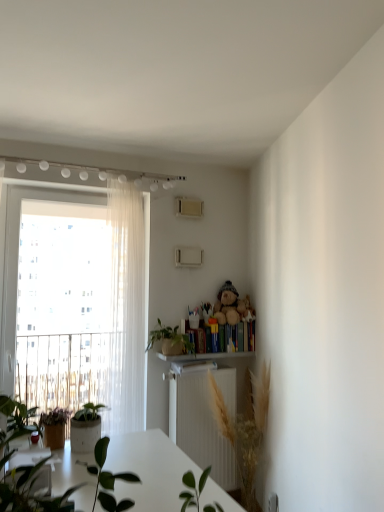
Question: Is green leafy plant at center, which is counted as the first houseplant, starting from the bottom, at the left side of fuzzy brown teddy bear at upper center?

Choices:
 (A) no
 (B) yes

Answer: (B)

Question: Considering the relative sizes of green leafy plant at center, which is counted as the first houseplant, starting from the bottom, and fuzzy brown teddy bear at upper center in the image provided, is green leafy plant at center, which is counted as the first houseplant, starting from the bottom, bigger than fuzzy brown teddy bear at upper center?

Choices:
 (A) no
 (B) yes

Answer: (B)

Question: Does green leafy plant at center, the 2th houseplant viewed from the top, have a lesser height compared to fuzzy brown teddy bear at upper center?

Choices:
 (A) no
 (B) yes

Answer: (A)

Question: Is green leafy plant at center, which is counted as the first houseplant, starting from the bottom, facing away from fuzzy brown teddy bear at upper center?

Choices:
 (A) no
 (B) yes

Answer: (A)

Question: Can you confirm if green leafy plant at center, which is counted as the first houseplant, starting from the bottom, is positioned to the right of fuzzy brown teddy bear at upper center?

Choices:
 (A) yes
 (B) no

Answer: (B)

Question: Considering the relative positions of sheer white curtain at left and green leafy plant at center, the 2th houseplant viewed from the top, in the image provided, is sheer white curtain at left to the left or to the right of green leafy plant at center, the 2th houseplant viewed from the top,?

Choices:
 (A) right
 (B) left

Answer: (B)

Question: In terms of size, does sheer white curtain at left appear bigger or smaller than green leafy plant at center, the 2th houseplant viewed from the top?

Choices:
 (A) small
 (B) big

Answer: (A)

Question: Is sheer white curtain at left in front of or behind green leafy plant at center, which is counted as the first houseplant, starting from the bottom, in the image?

Choices:
 (A) behind
 (B) front

Answer: (A)

Question: From a real-world perspective, is sheer white curtain at left above or below green leafy plant at center, the 2th houseplant viewed from the top?

Choices:
 (A) above
 (B) below

Answer: (A)

Question: Would you say fuzzy brown teddy bear at upper center is inside or outside hardcover books at right?

Choices:
 (A) inside
 (B) outside

Answer: (B)

Question: Is fuzzy brown teddy bear at upper center in front of or behind hardcover books at right in the image?

Choices:
 (A) behind
 (B) front

Answer: (B)

Question: From the image's perspective, relative to hardcover books at right, is fuzzy brown teddy bear at upper center above or below?

Choices:
 (A) below
 (B) above

Answer: (B)

Question: Looking at their shapes, would you say fuzzy brown teddy bear at upper center is wider or thinner than hardcover books at right?

Choices:
 (A) wide
 (B) thin

Answer: (A)

Question: Considering their positions, is hardcover books at right located in front of or behind sheer white curtain at left?

Choices:
 (A) front
 (B) behind

Answer: (B)

Question: Based on their positions, is hardcover books at right located to the left or right of sheer white curtain at left?

Choices:
 (A) left
 (B) right

Answer: (B)